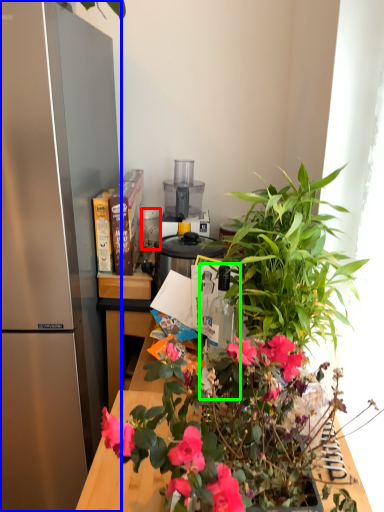
Question: Estimate the real-world distances between objects in this image. Which object is closer to appliance (highlighted by a red box), refrigerator (highlighted by a blue box) or bottle (highlighted by a green box)?

Choices:
 (A) refrigerator
 (B) bottle

Answer: (A)